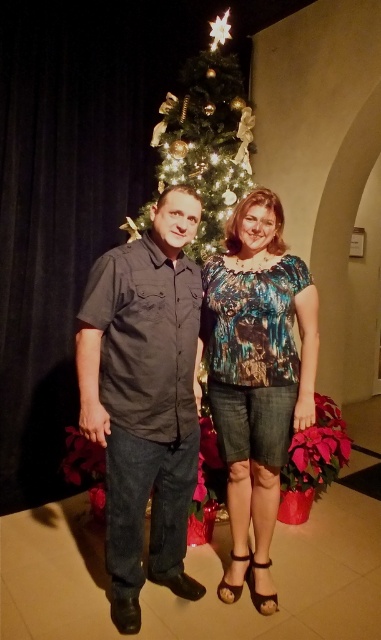
You are a photographer positioned at the back of the room. You want to capture a photo of the matte black shirt at center and the green glittering christmas tree at center in the same frame. Given that your camera has a minimum focus distance of 1 meter, will both subjects be in focus?

The distance between the matte black shirt at center and the green glittering christmas tree at center is 1.17 meters. Since the camera requires a minimum focus distance of 1 meter, the subjects are within range and will both be in focus.

You are a photographer at a Christmas party and want to take a photo of the printed fabric blouse at center and the green glittering christmas tree at center. Since the camera can only focus on one object at a time, which object should you focus on first if you want to capture the one closer to the camera?

The printed fabric blouse at center is to the right of green glittering christmas tree at center, but their distance from the camera isn

From the picture: You are organizing a photo shoot and need to ensure that both the printed fabric blouse at center and the green glittering christmas tree at center are visible in the frame. Given their sizes, which object should you prioritize positioning closer to the camera to maintain their visibility?

Since the printed fabric blouse at center is smaller than the green glittering christmas tree at center, you should prioritize positioning the printed fabric blouse at center closer to the camera to ensure it remains visible in the frame.